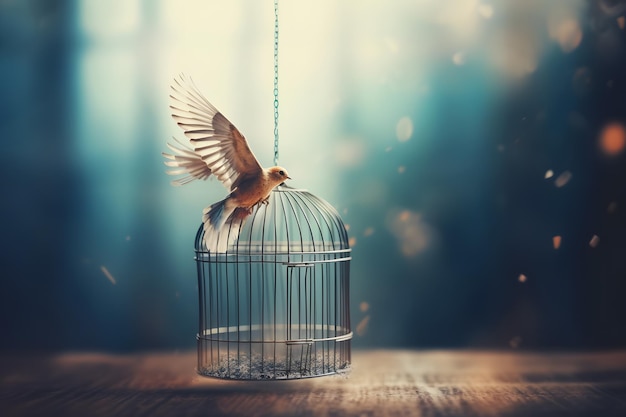
The image size is (626, 417). What are the coordinates of `blurred bright window pane` in the screenshot? It's located at (109, 126), (109, 24), (223, 30), (249, 111), (321, 100), (325, 27), (399, 32), (392, 94), (389, 173).